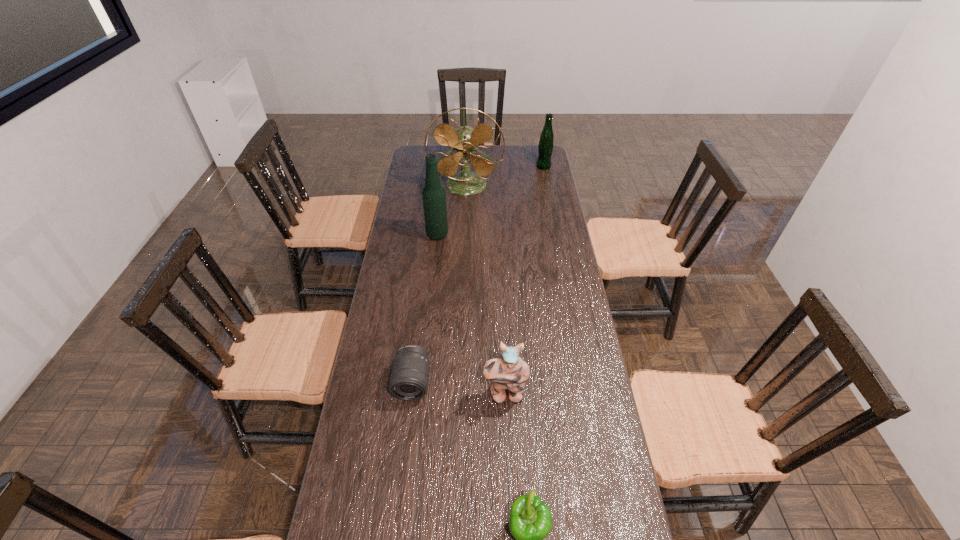
The image size is (960, 540). Identify the location of fan. (464, 140).

Where is `alcohol`? Image resolution: width=960 pixels, height=540 pixels. alcohol is located at coordinates (434, 196).

Identify the location of beer bottle. This screenshot has width=960, height=540. (546, 143).

Where is `the rightmost object`? Image resolution: width=960 pixels, height=540 pixels. the rightmost object is located at coordinates (546, 143).

Image resolution: width=960 pixels, height=540 pixels. I want to click on figurine, so click(x=510, y=371).

The image size is (960, 540). Identify the location of telephoto lens. [409, 377].

Find the location of a particular element. free space located in front of the fifth nearest object, directing air flow is located at coordinates (464, 240).

At what (x,y) coordinates should I click in order to perform the action: click on free spot located on the back of the fourth nearest object. Please return your answer as a coordinate pair (x, y). Looking at the image, I should click on pyautogui.click(x=443, y=183).

You are a GUI agent. You are given a task and a screenshot of the screen. Output one action in this format:
    pyautogui.click(x=<x>, y=<y>)
    Task: Click on the vacant space situated 0.160m on the back of the farthest object
    The width and height of the screenshot is (960, 540).
    Given the screenshot: What is the action you would take?
    pyautogui.click(x=540, y=147)

At what (x,y) coordinates should I click in order to perform the action: click on vacant region located 0.210m on the front-facing side of the figurine. Please return your answer as a coordinate pair (x, y). The image size is (960, 540). Looking at the image, I should click on (509, 479).